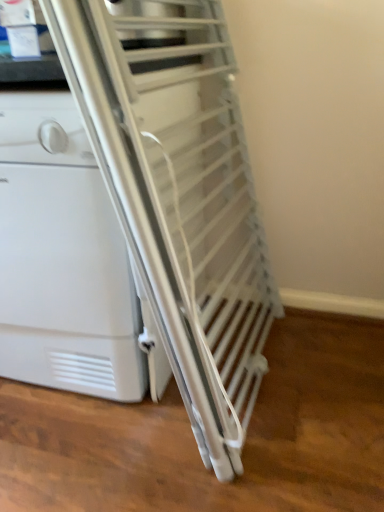
The image size is (384, 512). In order to click on white matte dishwasher at left in this screenshot , I will do `click(62, 258)`.

Measure the distance between white matte dishwasher at left and camera.

They are 34.33 inches apart.

This screenshot has height=512, width=384. What do you see at coordinates (62, 258) in the screenshot?
I see `white matte dishwasher at left` at bounding box center [62, 258].

Where is `white matte dishwasher at left`? The width and height of the screenshot is (384, 512). white matte dishwasher at left is located at coordinates (62, 258).